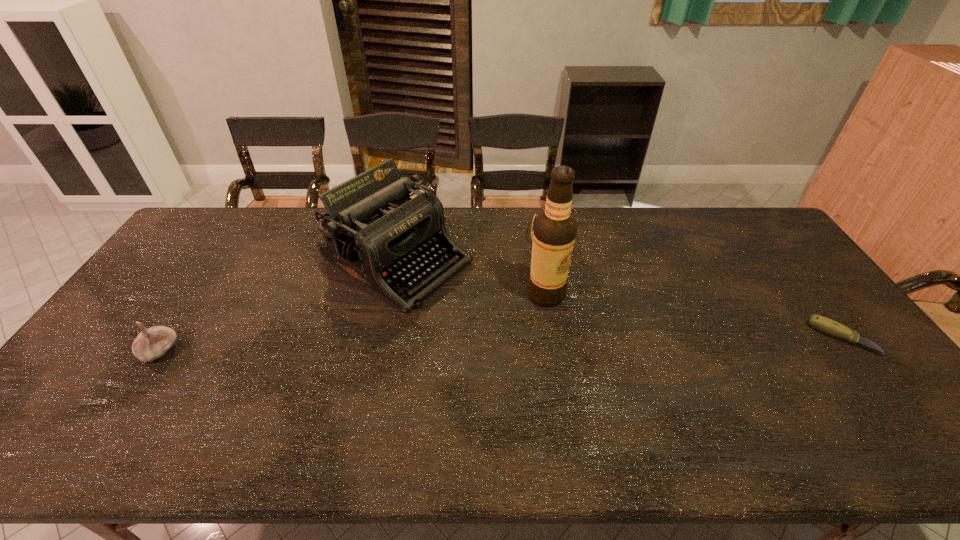
Find the location of a particular element. The height and width of the screenshot is (540, 960). vacant space located 0.100m on the keyboard of the typewriter is located at coordinates (480, 308).

The height and width of the screenshot is (540, 960). In order to click on blank area located on the keyboard of the typewriter in this screenshot , I will do `click(507, 325)`.

The height and width of the screenshot is (540, 960). Identify the location of vacant space located 0.090m on the keyboard of the typewriter. (477, 307).

Locate an element on the screen. vacant region located on the front-facing side of the sunglasses is located at coordinates (552, 284).

The width and height of the screenshot is (960, 540). What are the coordinates of `vacant space located on the front-facing side of the sunglasses` in the screenshot? It's located at (551, 275).

In order to click on vacant space located on the front-facing side of the sunglasses in this screenshot , I will do `click(551, 269)`.

You are a GUI agent. You are given a task and a screenshot of the screen. Output one action in this format:
    pyautogui.click(x=<x>, y=<y>)
    Task: Click on the vacant space located 0.100m on the label of the tallest object
    The image size is (960, 540).
    Given the screenshot: What is the action you would take?
    pyautogui.click(x=572, y=332)

I want to click on free space located 0.250m on the label of the tallest object, so click(x=602, y=374).

At what (x,y) coordinates should I click in order to perform the action: click on free point located on the label of the tallest object. Please return your answer as a coordinate pair (x, y). Looking at the image, I should click on (564, 319).

In order to click on typewriter at the far edge in this screenshot , I will do `click(373, 231)`.